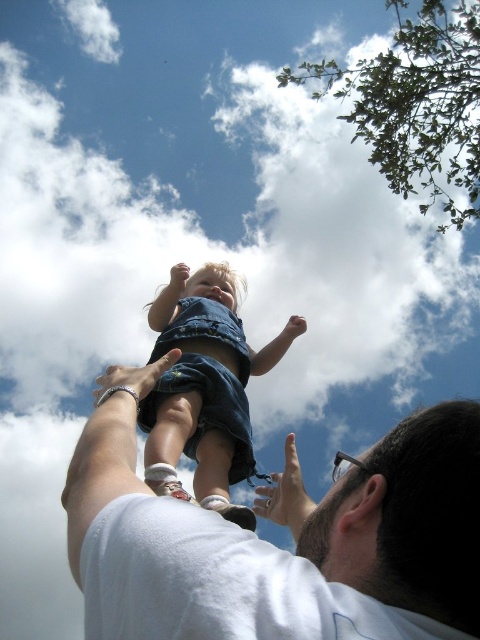
You are a photographer trying to capture the scene where the man in the white cotton shirt at upper center and the child in denim shorts at center are interacting. From your position, which object is positioned to the right side?

The white cotton shirt at upper center is positioned to the right of the denim shorts at center.

You are a photographer trying to capture the scene where the man is holding the child. You notice the white cotton shirt at upper center and the matte skin hand at upper center in your viewfinder. Which object should you focus on first if you want to ensure both are in sharp focus, considering their positions?

The white cotton shirt at upper center is positioned on the left side of matte skin hand at upper center. To ensure both are in sharp focus, focus on the white cotton shirt at upper center first as it is closer to the left edge, allowing the depth of field to cover the matte skin hand at upper center.

Based on the coordinates provided, where is the white cotton shirt at upper center located in the image?

The white cotton shirt at upper center is located at the coordinates point (275,547) in the image.